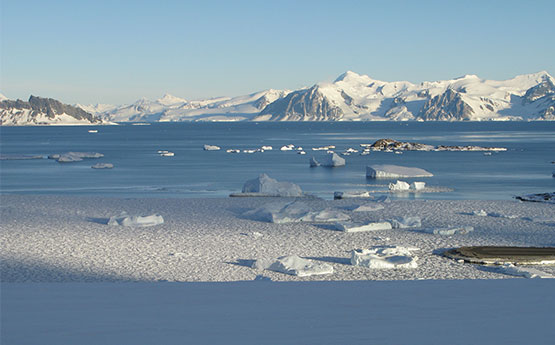
Locate an element on the screen. white stand is located at coordinates (180, 234).